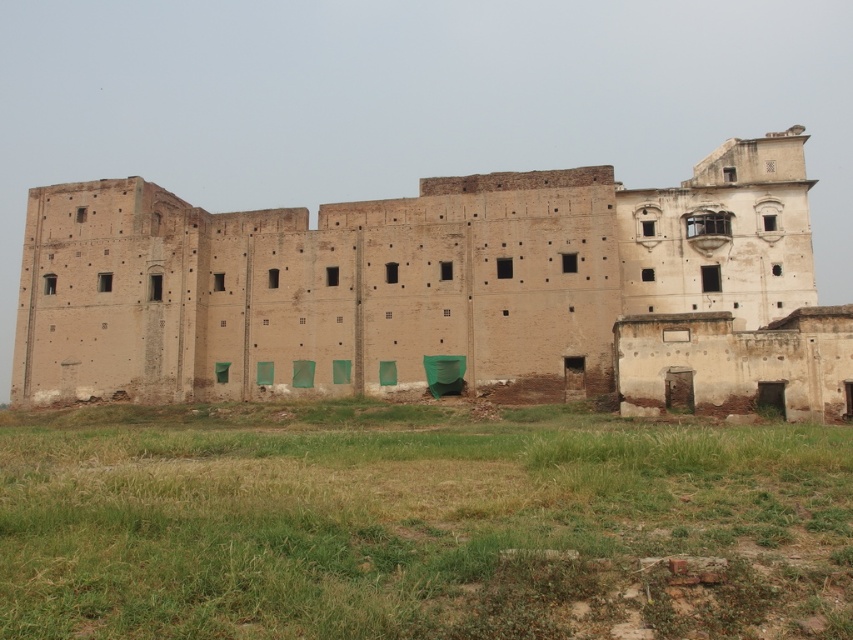
Which is in front, point (573, 432) or point (61, 312)?

Point (573, 432) is more forward.

Is green grass at lower center shorter than beige brick ruins at center?

Yes.

Is point (730, 506) closer to viewer compared to point (512, 214)?

That is True.

At what (x,y) coordinates should I click in order to perform the action: click on green grass at lower center. Please return your answer as a coordinate pair (x, y). The image size is (853, 640). Looking at the image, I should click on [x=416, y=522].